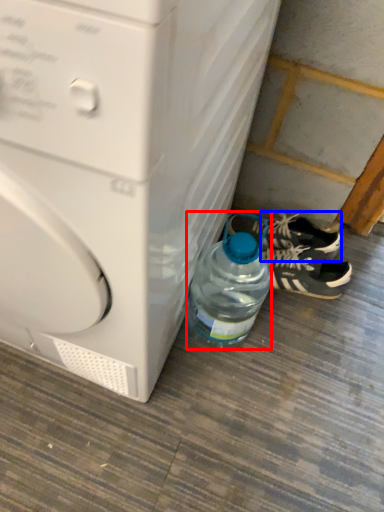
Question: Among these objects, which one is farthest to the camera, bottle (highlighted by a red box) or sneakers (highlighted by a blue box)?

Choices:
 (A) bottle
 (B) sneakers

Answer: (B)